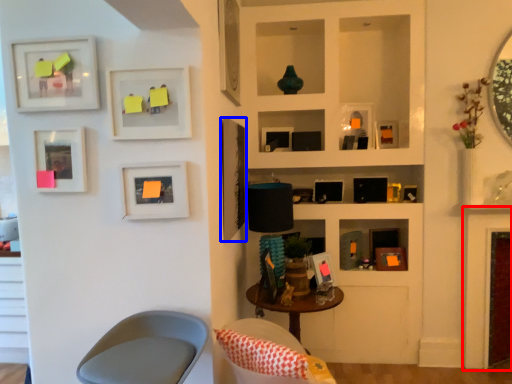
Question: Which object is further to the camera taking this photo, fireplace (highlighted by a red box) or picture frame (highlighted by a blue box)?

Choices:
 (A) fireplace
 (B) picture frame

Answer: (A)